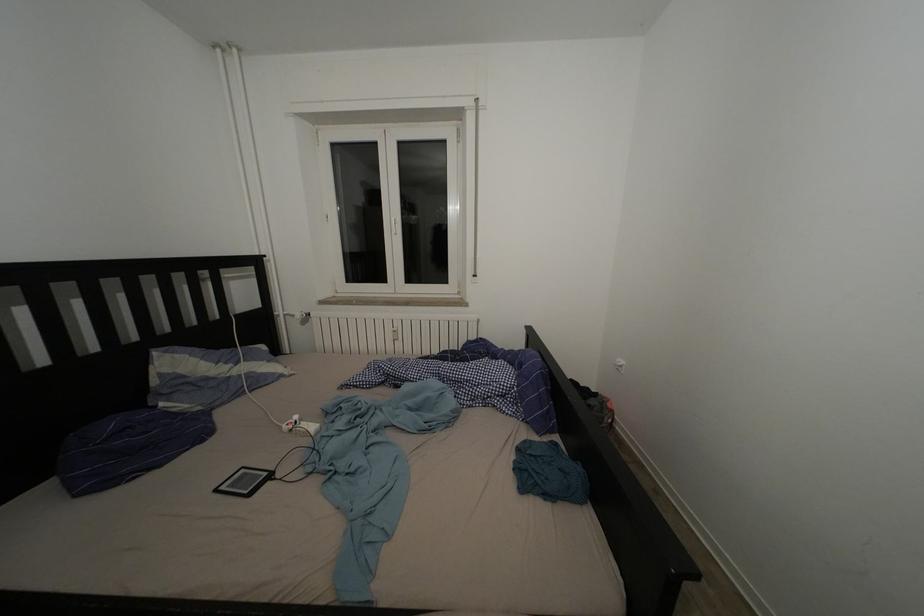
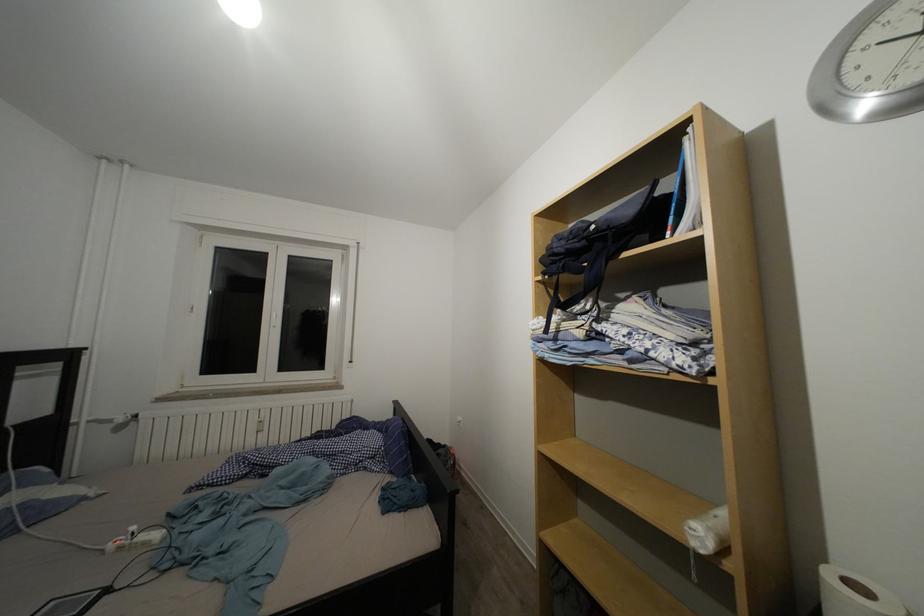
First-person continuous shooting, in which direction is the camera rotating?

The camera rotated toward right-up.